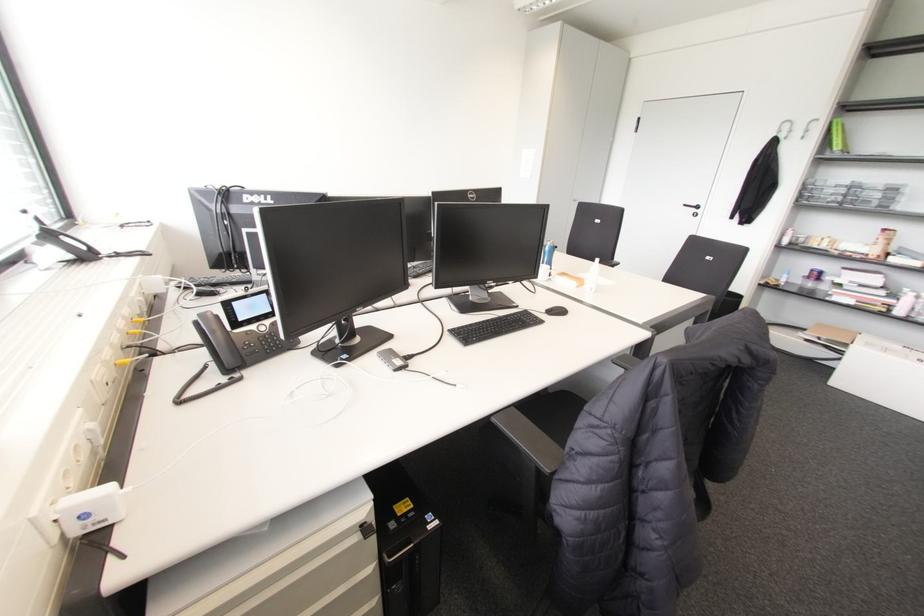
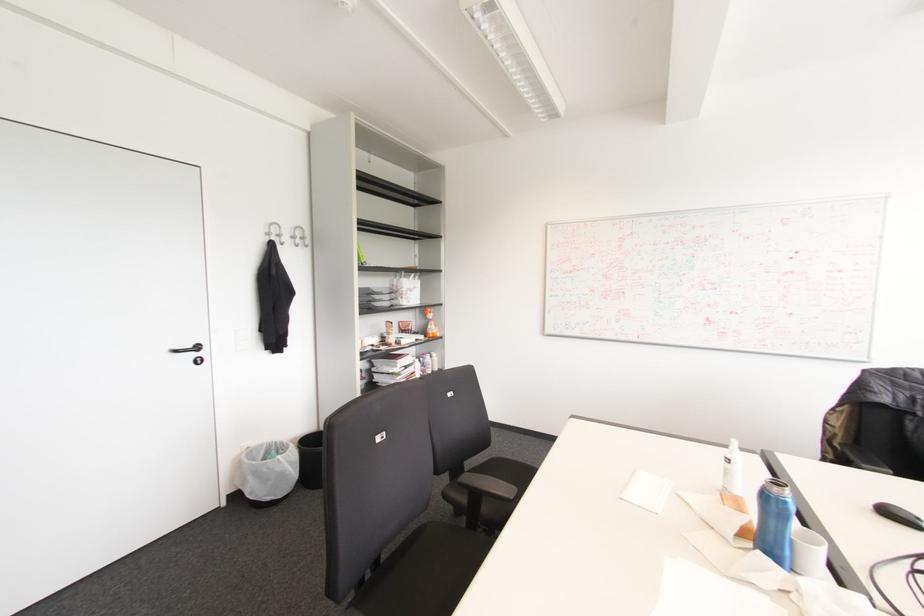
Where in the second image is the point corresponding to point 697,207 from the first image?

(197, 347)